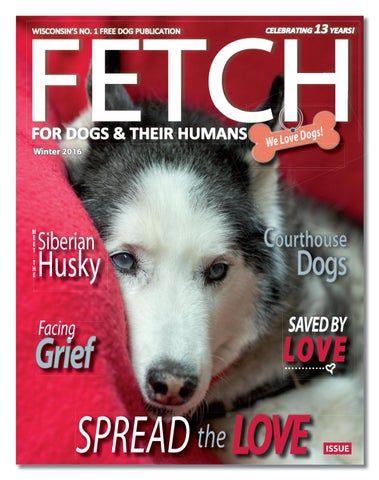
Where is `magazines`? This screenshot has width=379, height=480. magazines is located at coordinates (188, 313).